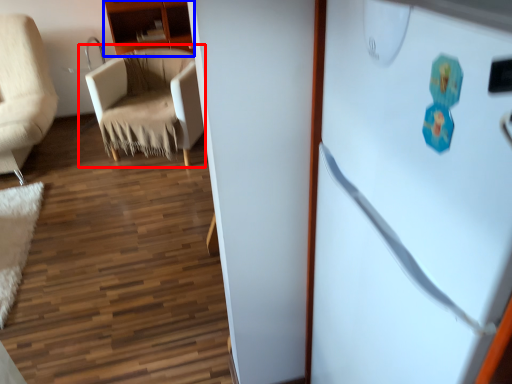
Question: Which of the following is the farthest to the observer, chair (highlighted by a red box) or cabinetry (highlighted by a blue box)?

Choices:
 (A) chair
 (B) cabinetry

Answer: (B)